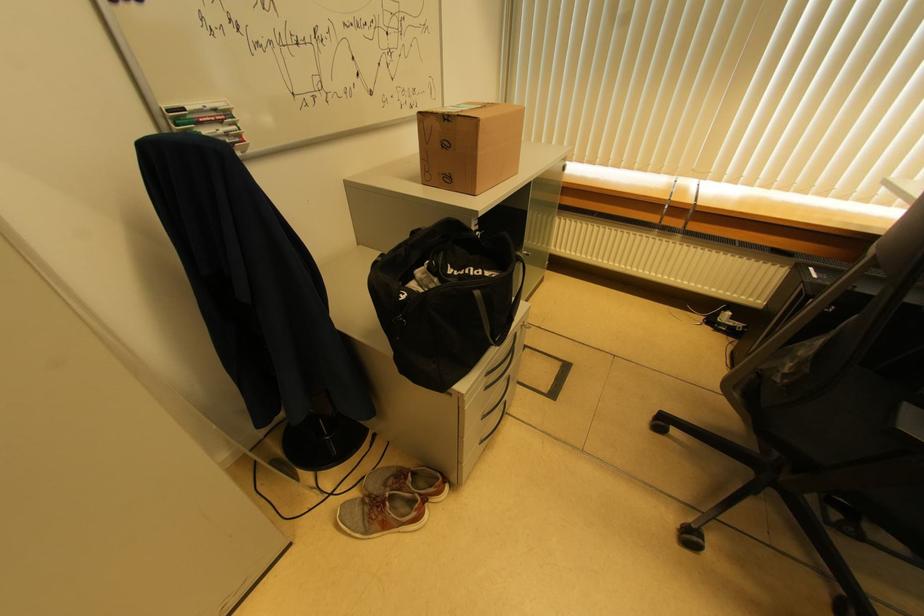
Find where to lift the gray and red shoe. Please return your answer as a coordinate pair (x, y).

(382, 514)